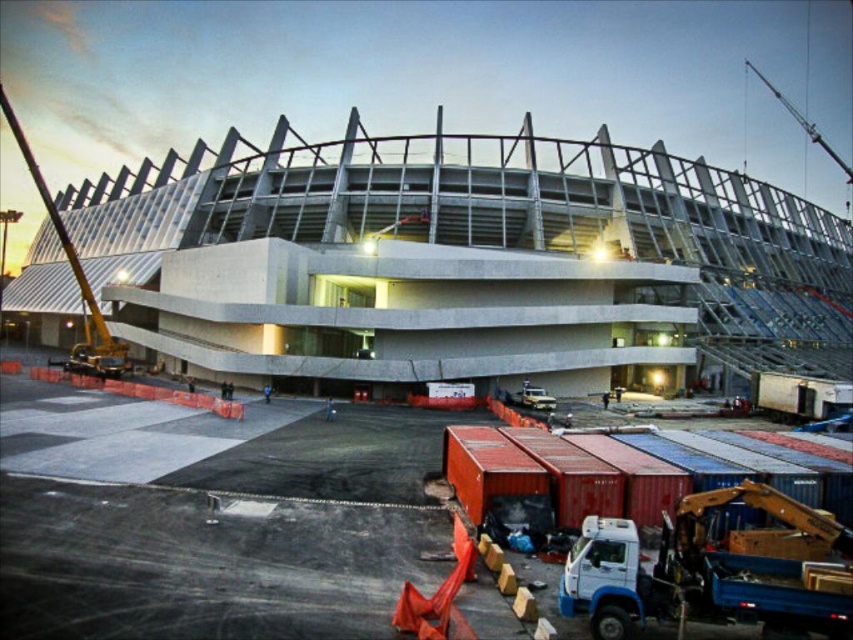
Is orange container at center shorter than metallic yellow crane at left?

Yes.

Between point (115, 472) and point (85, 307), which one is positioned in front?

Positioned in front is point (115, 472).

You are a GUI agent. You are given a task and a screenshot of the screen. Output one action in this format:
    pyautogui.click(x=<x>, y=<y>)
    Task: Click on the orange container at center
    The height and width of the screenshot is (640, 853).
    Given the screenshot: What is the action you would take?
    pyautogui.click(x=207, y=564)

The width and height of the screenshot is (853, 640). In order to click on orange container at center in this screenshot , I will do `click(207, 564)`.

Can you confirm if concrete stadium at center is thinner than orange container at center?

In fact, concrete stadium at center might be wider than orange container at center.

Is point (587, 172) in front of point (508, 616)?

No.

This screenshot has height=640, width=853. Identify the location of concrete stadium at center. click(x=462, y=260).

Who is taller, orange container at center or metallic yellow crane at lower right?

With more height is orange container at center.

Which is behind, point (123, 497) or point (663, 513)?

Point (123, 497)

Find the location of `orange container at center`. orange container at center is located at coordinates (207, 564).